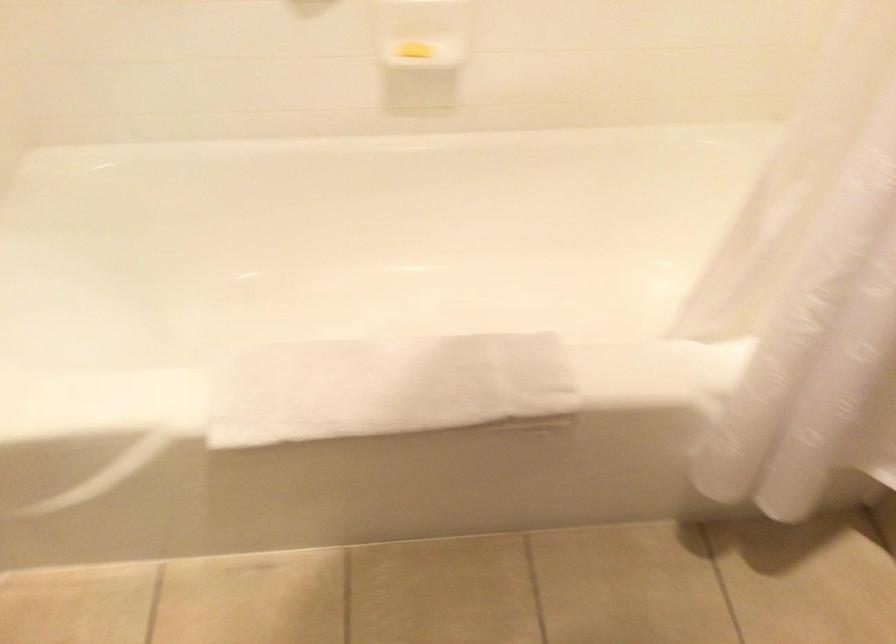
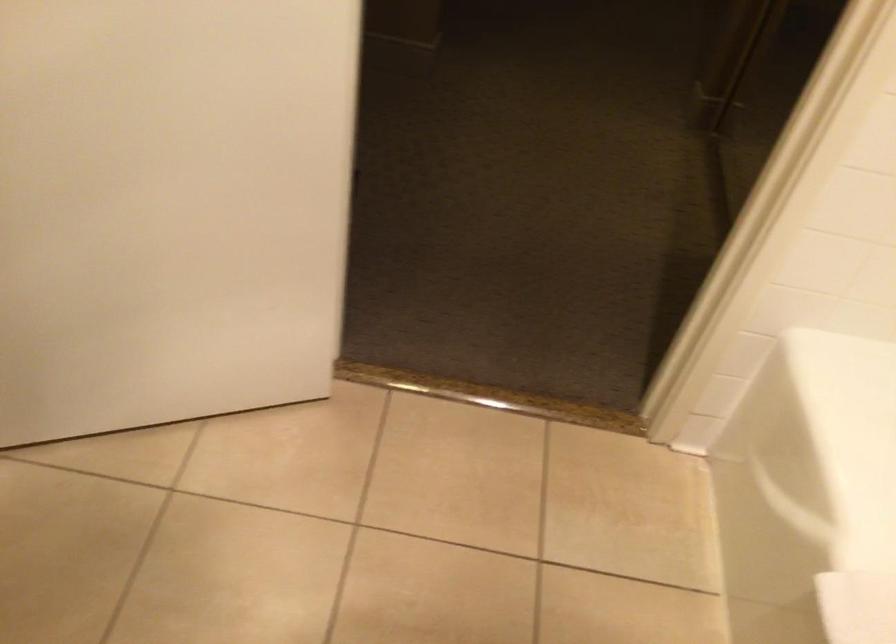
First-person continuous shooting, in which direction is the camera rotating?

The camera's rotation is toward left-down.